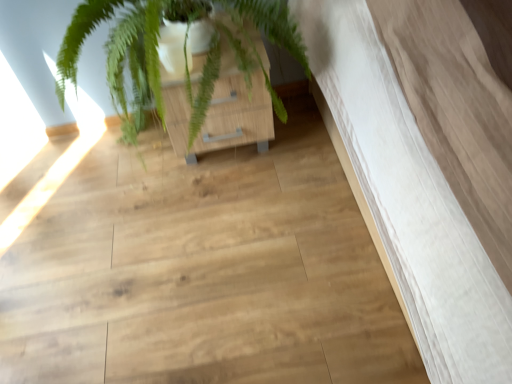
Find the location of a particular element. spots to the right of wooden cabinet at center is located at coordinates (305, 140).